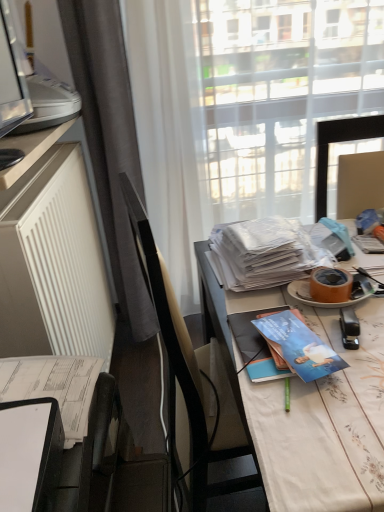
Where is `vacant space situated on the left part of orange matte plate at right`? vacant space situated on the left part of orange matte plate at right is located at coordinates (253, 298).